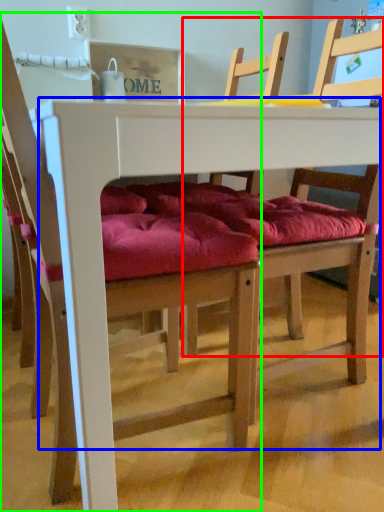
Question: Which is nearer to the chair (highlighted by a red box)? table (highlighted by a blue box) or chair (highlighted by a green box).

Choices:
 (A) table
 (B) chair

Answer: (B)